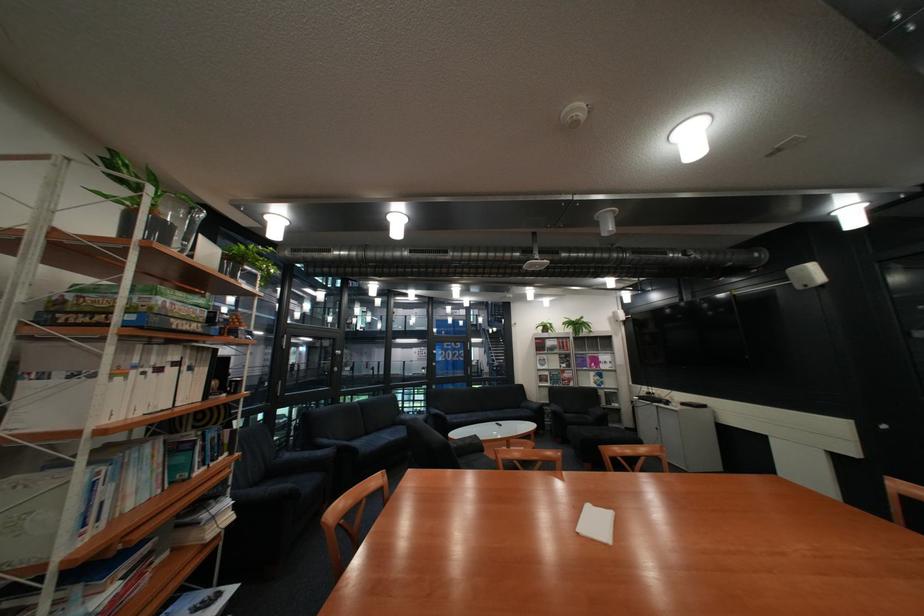
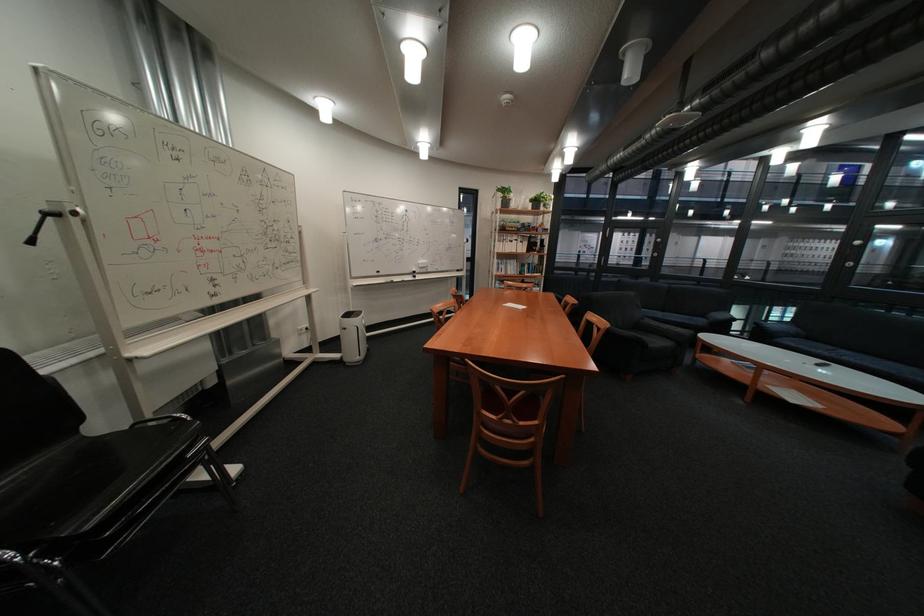
Find the pixel in the second image that matches (475,421) in the first image.

(808, 345)